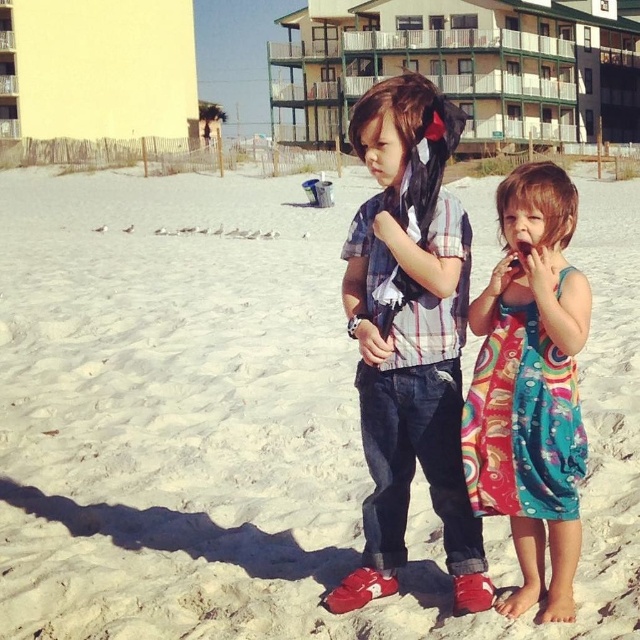
You are a photographer taking a picture of the beach scene. You want to focus on the multicolored fabric dress at right and the green wooden balcony at upper center. Which object should you adjust your camera to focus on first if you want to capture both in sharp detail?

You should focus on the green wooden balcony at upper center first because it is closer to the viewer than the multicolored fabric dress at right, allowing both to be in sharp detail by adjusting focus accordingly.

You are a photographer planning to take a photo of the white sand at center and the yellow painted building at upper left. Which object should you focus on first if you want to capture both in the same frame without moving the camera?

You should focus on the white sand at center first because it is smaller than the yellow painted building at upper left, allowing you to frame both objects effectively in the same shot.

In the scene shown: You are a painter standing on the beach. You want to paint both the green wooden balcony at upper center and the multicolored fabric dress at right. Which object should you focus on first if you want to paint the wider one first?

The green wooden balcony at upper center should be painted first because its width surpasses the multicolored fabric dress at right.